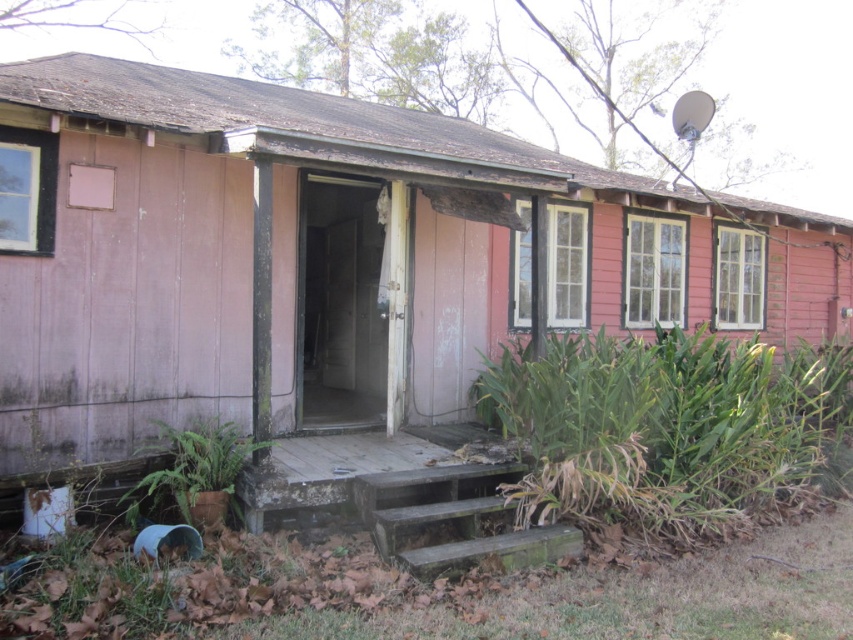
You are a delivery person carrying a box that is 1 meter wide. You need to place it between the green leafy plant at lower right and the dark green concrete stairs at center. Is there enough space?

The green leafy plant at lower right and dark green concrete stairs at center are 93.63 centimeters apart from each other. Since the box is 1 meter wide, which is 100 centimeters, there isn not enough space to fit the box between them.